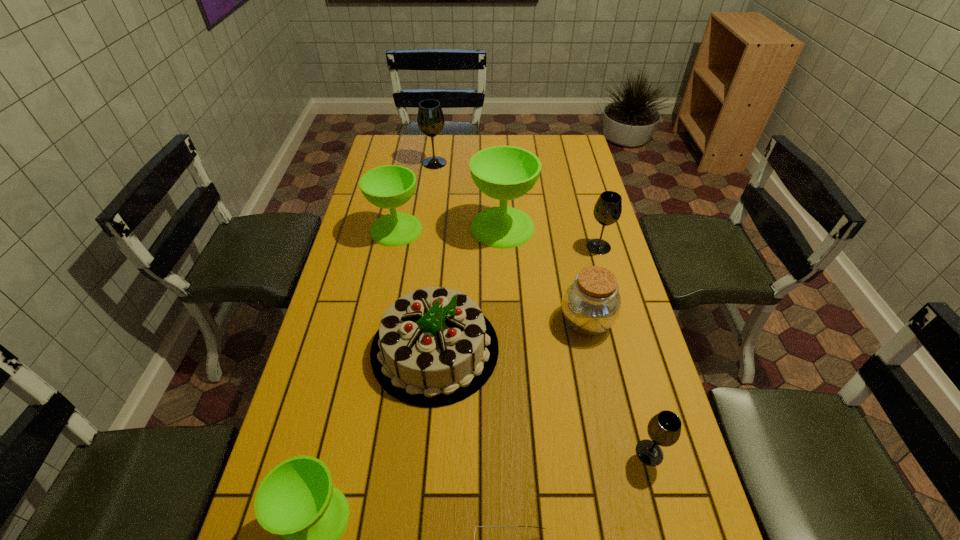
The height and width of the screenshot is (540, 960). What are the coordinates of `free region that satisfies the following two spatial constraints: 1. on the front side of the second smallest green wineglass; 2. on the left side of the second nearest gray wineglass` in the screenshot? It's located at (393, 247).